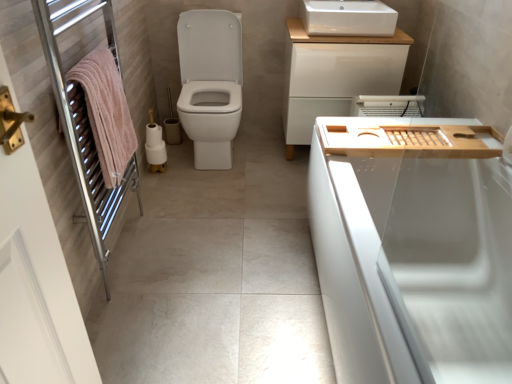
Where is `vacant area that is in front of white glossy toilet at center`? Image resolution: width=512 pixels, height=384 pixels. vacant area that is in front of white glossy toilet at center is located at coordinates (209, 194).